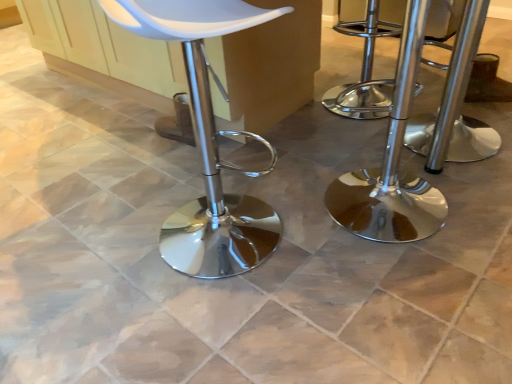
You are a GUI agent. You are given a task and a screenshot of the screen. Output one action in this format:
    pyautogui.click(x=<x>, y=<y>)
    Task: Click on the vacant space to the right of chrome/metallic stool at right, acting as the first stool starting from the left
    This screenshot has height=384, width=512.
    Given the screenshot: What is the action you would take?
    pyautogui.click(x=473, y=196)